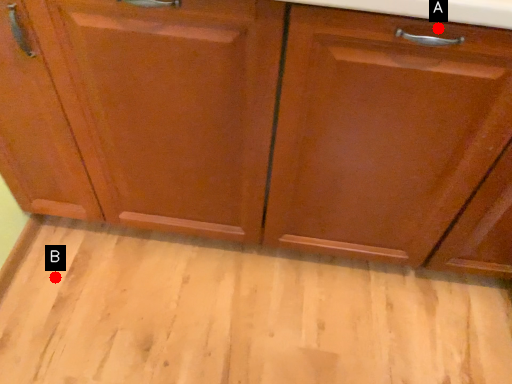
Question: Two points are circled on the image, labeled by A and B beside each circle. Which point appears farthest from the camera in this image?

Choices:
 (A) A is further
 (B) B is further

Answer: (B)